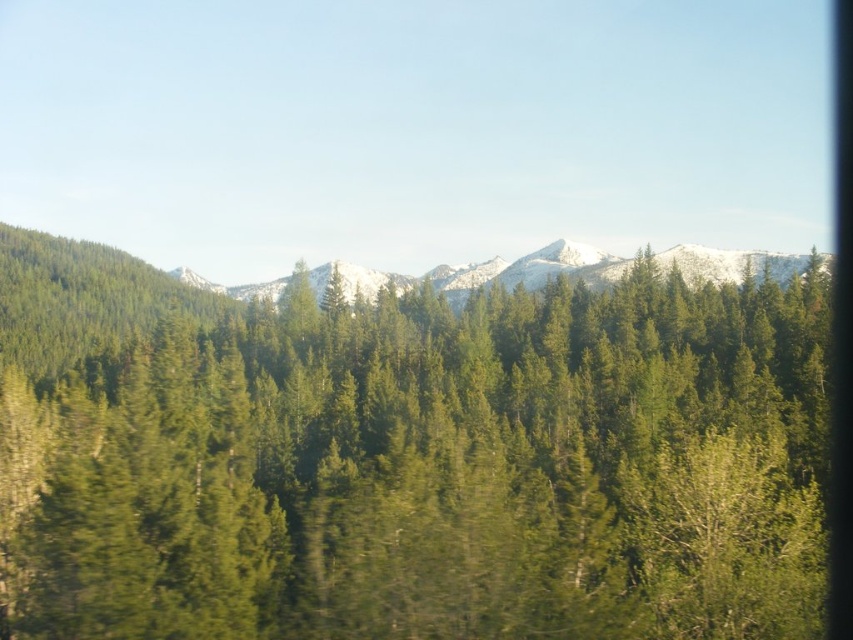
Between green matte tree at center and snowy rocky mountain at center, which one is positioned lower?

Positioned lower is green matte tree at center.

From the picture: Who is positioned more to the right, green matte tree at center or snowy rocky mountain at center?

From the viewer's perspective, snowy rocky mountain at center appears more on the right side.

Does point (235, 627) come closer to viewer compared to point (503, 260)?

Yes, point (235, 627) is in front of point (503, 260).

This screenshot has width=853, height=640. What are the coordinates of `green matte tree at center` in the screenshot? It's located at (407, 458).